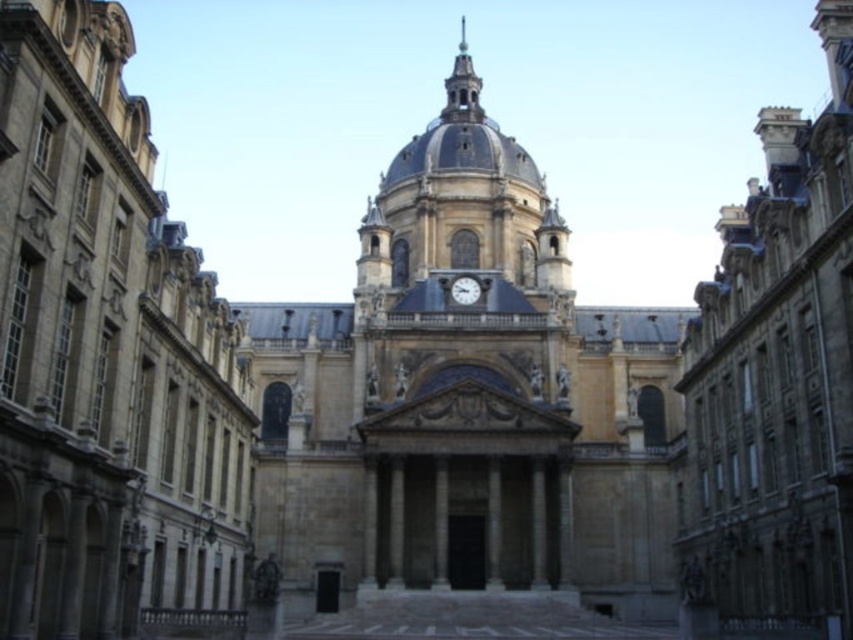
You are a maintenance worker needing to reach both the polished copper spire at upper center and the metallic gray clock at center. You have a ladder that extends to 50 meters. Can you safely reach both objects with this ladder?

The distance between the polished copper spire at upper center and the metallic gray clock at center is 54.76 meters. Since your ladder only extends to 50 meters, you cannot safely reach both objects with this ladder.

You are standing in front of the grand architectural structure. There is a point marked at coordinates point (463,76). Can you reach this point by walking forward from your current position?

The point (463,76) is 160.28 meters away from the camera, so you cannot reach it by walking forward from your current position as it is too far away.

You are standing in front of the grand structure and want to take a photo of both the polished copper spire at upper center and the metallic gray clock at center. Which object should you focus on first to ensure both are in the frame?

You should focus on the polished copper spire at upper center first because it is closer to you than the metallic gray clock at center, so adjusting the camera to include it will also capture the clock behind it.